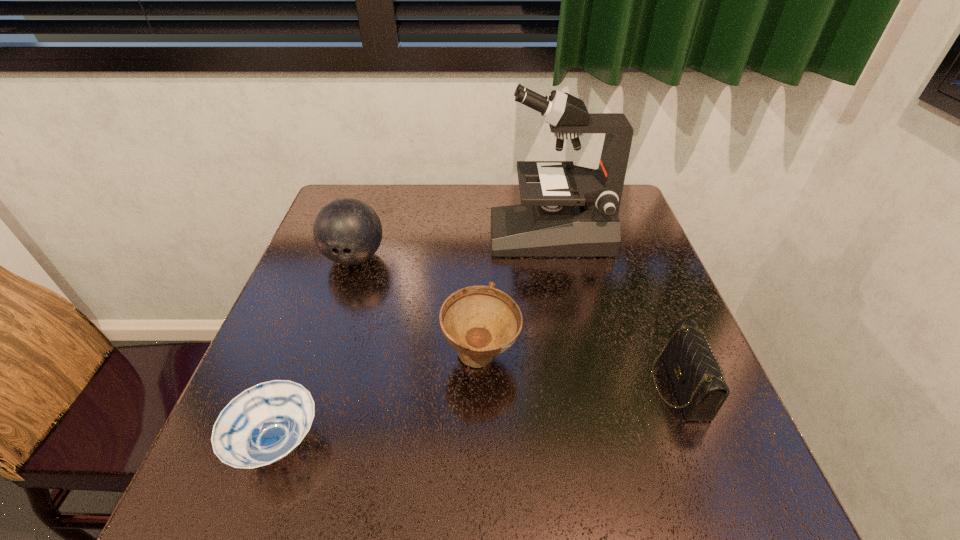
I want to click on microscope located at the right edge, so click(573, 212).

You are a GUI agent. You are given a task and a screenshot of the screen. Output one action in this format:
    pyautogui.click(x=<x>, y=<y>)
    Task: Click on the clutch bag that is at the right edge
    
    Given the screenshot: What is the action you would take?
    pyautogui.click(x=693, y=368)

The image size is (960, 540). What are the coordinates of `object that is positioned at the near left corner` in the screenshot? It's located at (265, 423).

Locate an element on the screen. object that is at the far right corner is located at coordinates (573, 212).

Find the location of `free space at the far edge of the desktop`. free space at the far edge of the desktop is located at coordinates (445, 186).

You are a GUI agent. You are given a task and a screenshot of the screen. Output one action in this format:
    pyautogui.click(x=<x>, y=<y>)
    Task: Click on the vacant space at the near edge of the desktop
    This screenshot has height=540, width=960.
    Given the screenshot: What is the action you would take?
    pyautogui.click(x=592, y=488)

The image size is (960, 540). In the image, there is a desktop. Find the location of `free space at the left edge`. free space at the left edge is located at coordinates (264, 377).

Where is `free point at the right edge`? Image resolution: width=960 pixels, height=540 pixels. free point at the right edge is located at coordinates (637, 278).

The image size is (960, 540). Find the location of `vacant area at the far left corner`. vacant area at the far left corner is located at coordinates (384, 201).

Locate an element on the screen. Image resolution: width=960 pixels, height=540 pixels. vacant space at the near right corner of the desktop is located at coordinates (691, 466).